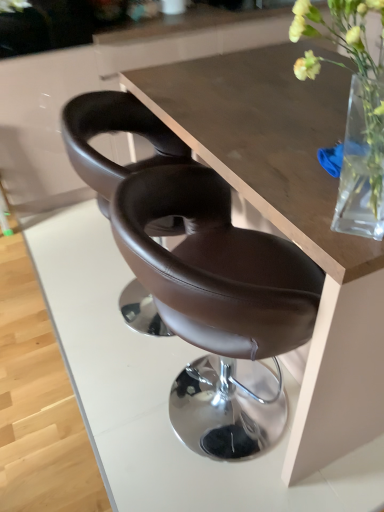
Question: From a real-world perspective, is brown leather chair at center, the 2th chair when ordered from back to front, beneath wooden table at center?

Choices:
 (A) no
 (B) yes

Answer: (B)

Question: Is brown leather chair at center, which is counted as the 1th chair, starting from the front, not inside wooden table at center?

Choices:
 (A) yes
 (B) no

Answer: (A)

Question: Is brown leather chair at center, the 2th chair when ordered from back to front, to the right of wooden table at center from the viewer's perspective?

Choices:
 (A) no
 (B) yes

Answer: (A)

Question: From the image's perspective, is brown leather chair at center, which is counted as the 1th chair, starting from the front, above wooden table at center?

Choices:
 (A) no
 (B) yes

Answer: (A)

Question: Would you consider brown leather chair at center, the 2th chair when ordered from back to front, to be distant from wooden table at center?

Choices:
 (A) yes
 (B) no

Answer: (B)

Question: From the image's perspective, is brown leather chair at center, the 2th chair when ordered from back to front, above or below translucent glass vase at upper right?

Choices:
 (A) below
 (B) above

Answer: (A)

Question: From a real-world perspective, is brown leather chair at center, which is counted as the 1th chair, starting from the front, physically located above or below translucent glass vase at upper right?

Choices:
 (A) above
 (B) below

Answer: (B)

Question: In terms of height, does brown leather chair at center, the 2th chair when ordered from back to front, look taller or shorter compared to translucent glass vase at upper right?

Choices:
 (A) short
 (B) tall

Answer: (B)

Question: Considering the positions of point (284, 345) and point (354, 102), is point (284, 345) closer or farther from the camera than point (354, 102)?

Choices:
 (A) farther
 (B) closer

Answer: (A)

Question: Does point (241, 392) appear closer or farther from the camera than point (261, 106)?

Choices:
 (A) closer
 (B) farther

Answer: (B)

Question: Do you think brown leather chair at center, which is counted as the 1th chair, starting from the front, is within wooden table at center, or outside of it?

Choices:
 (A) outside
 (B) inside

Answer: (A)

Question: In terms of size, does brown leather chair at center, the 2th chair when ordered from back to front, appear bigger or smaller than wooden table at center?

Choices:
 (A) big
 (B) small

Answer: (B)

Question: Considering the positions of brown leather chair at center, the 2th chair when ordered from back to front, and wooden table at center in the image, is brown leather chair at center, the 2th chair when ordered from back to front, taller or shorter than wooden table at center?

Choices:
 (A) tall
 (B) short

Answer: (B)

Question: Is point pyautogui.click(x=16, y=1) closer or farther from the camera than point pyautogui.click(x=82, y=112)?

Choices:
 (A) closer
 (B) farther

Answer: (B)

Question: From a real-world perspective, is white matte flower at upper center positioned above or below brown leather chair at center, positioned as the 1th chair in back-to-front order?

Choices:
 (A) above
 (B) below

Answer: (A)